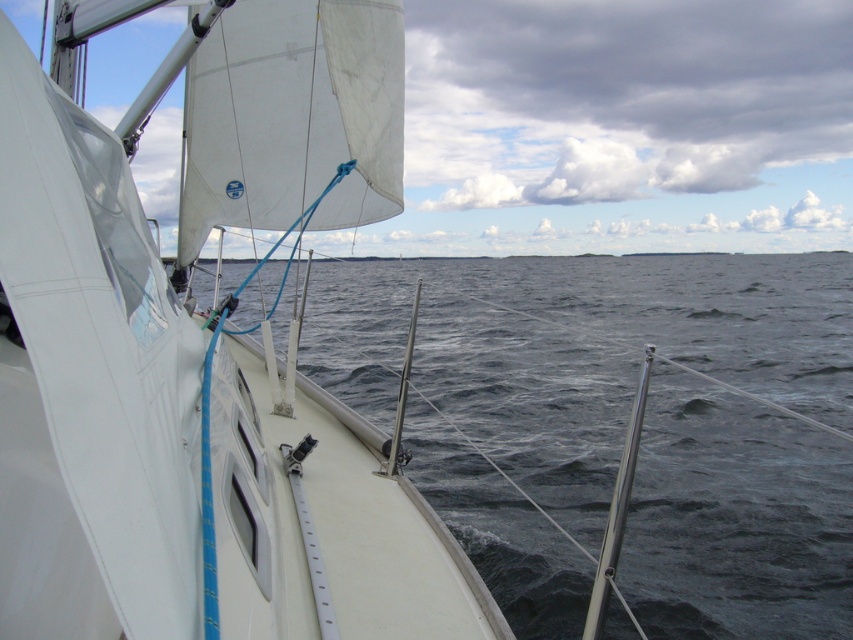
Who is positioned more to the left, white matte sailboat at left or dark blue water at center?

white matte sailboat at left is more to the left.

Between white matte sailboat at left and dark blue water at center, which one is positioned higher?

dark blue water at center is higher up.

What do you see at coordinates (202, 356) in the screenshot? The width and height of the screenshot is (853, 640). I see `white matte sailboat at left` at bounding box center [202, 356].

At what (x,y) coordinates should I click in order to perform the action: click on white matte sailboat at left. Please return your answer as a coordinate pair (x, y). The height and width of the screenshot is (640, 853). Looking at the image, I should click on (202, 356).